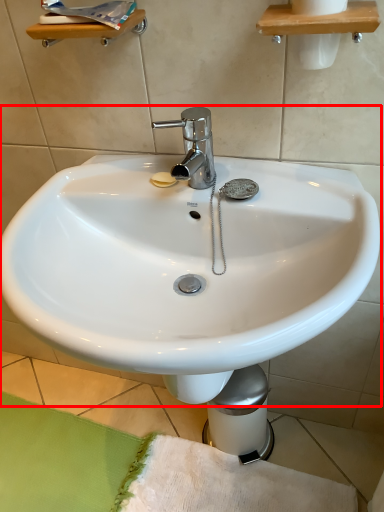
Question: From the image's perspective, where is sink (annotated by the red box) located in relation to bath mat in the image?

Choices:
 (A) below
 (B) above

Answer: (B)